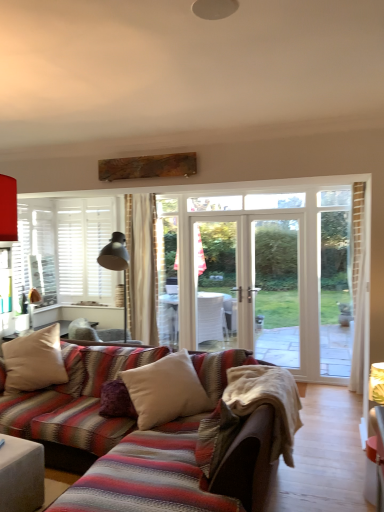
Question: Is white soft cushion at center, the third pillow from the left, closer to camera compared to matte gray ottoman at lower left?

Choices:
 (A) yes
 (B) no

Answer: (B)

Question: Does white soft cushion at center, the third pillow from the left, have a greater width compared to matte gray ottoman at lower left?

Choices:
 (A) yes
 (B) no

Answer: (A)

Question: Can you confirm if white soft cushion at center, which ranks as the first pillow in right-to-left order, is taller than matte gray ottoman at lower left?

Choices:
 (A) no
 (B) yes

Answer: (B)

Question: Does white soft cushion at center, the third pillow from the left, have a smaller size compared to matte gray ottoman at lower left?

Choices:
 (A) no
 (B) yes

Answer: (A)

Question: Does white soft cushion at center, which ranks as the first pillow in right-to-left order, have a larger size compared to matte gray ottoman at lower left?

Choices:
 (A) no
 (B) yes

Answer: (B)

Question: Is white soft cushion at center, which ranks as the first pillow in right-to-left order, next to matte gray ottoman at lower left and touching it?

Choices:
 (A) no
 (B) yes

Answer: (A)

Question: From a real-world perspective, does matte gray ottoman at lower left sit lower than white soft cushion at center, which ranks as the first pillow in right-to-left order?

Choices:
 (A) no
 (B) yes

Answer: (B)

Question: Does matte gray ottoman at lower left have a lesser width compared to white soft cushion at center, which ranks as the first pillow in right-to-left order?

Choices:
 (A) no
 (B) yes

Answer: (B)

Question: Is matte gray ottoman at lower left completely or partially outside of white soft cushion at center, the third pillow from the left?

Choices:
 (A) no
 (B) yes

Answer: (B)

Question: Does matte gray ottoman at lower left contain white soft cushion at center, the third pillow from the left?

Choices:
 (A) yes
 (B) no

Answer: (B)

Question: From the image's perspective, is matte gray ottoman at lower left under white soft cushion at center, the third pillow from the left?

Choices:
 (A) yes
 (B) no

Answer: (A)

Question: Can you see matte gray ottoman at lower left touching white soft cushion at center, which ranks as the first pillow in right-to-left order?

Choices:
 (A) no
 (B) yes

Answer: (A)

Question: Considering the relative sizes of matte gray ottoman at lower left and beige cotton blanket at lower center in the image provided, is matte gray ottoman at lower left wider than beige cotton blanket at lower center?

Choices:
 (A) no
 (B) yes

Answer: (A)